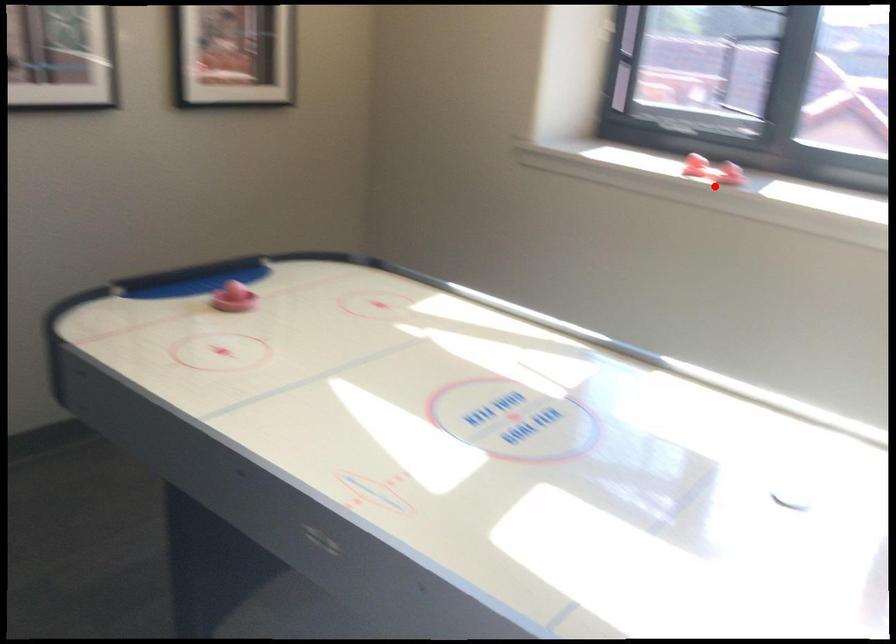
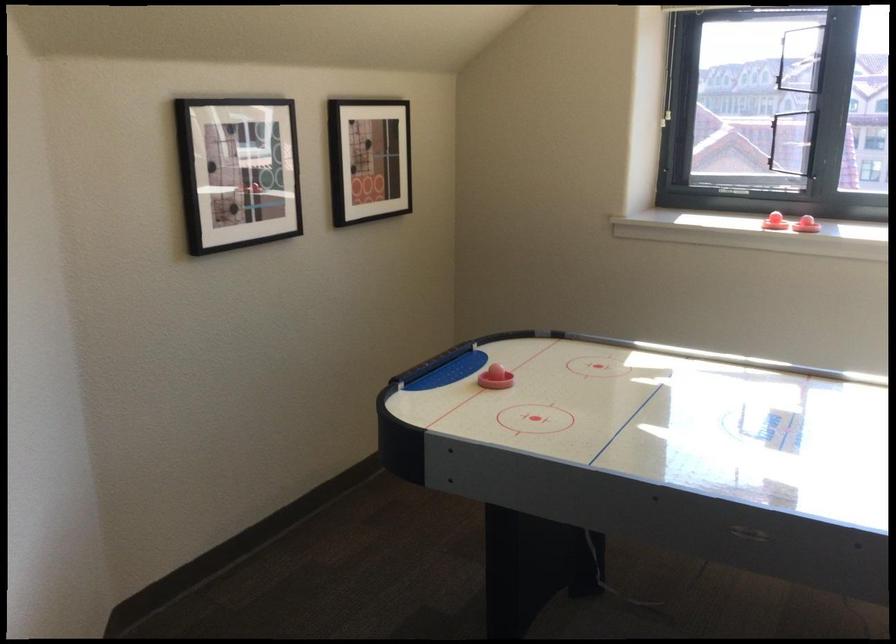
The point at the highlighted location is marked in the first image. Where is the corresponding point in the second image?

(806, 225)